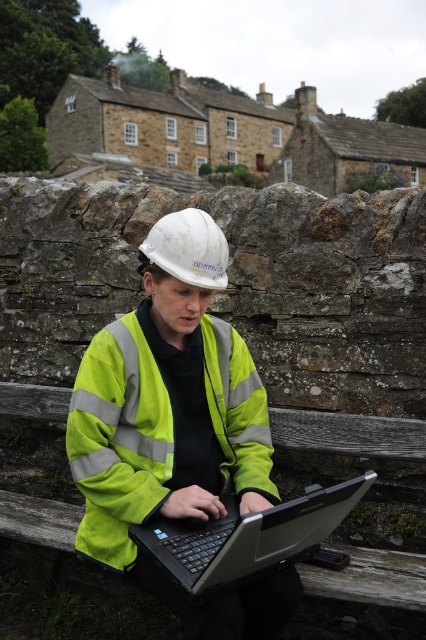
Question: Among these points, which one is nearest to the camera?

Choices:
 (A) (227, 333)
 (B) (215, 522)

Answer: (B)

Question: Is neon yellow reflective vest at center behind black plastic laptop at center?

Choices:
 (A) yes
 (B) no

Answer: (A)

Question: Is neon yellow reflective vest at center bigger than black plastic laptop at center?

Choices:
 (A) no
 (B) yes

Answer: (B)

Question: Is neon yellow reflective vest at center bigger than black plastic laptop at center?

Choices:
 (A) no
 (B) yes

Answer: (B)

Question: Among these points, which one is nearest to the camera?

Choices:
 (A) (158, 326)
 (B) (310, 497)

Answer: (B)